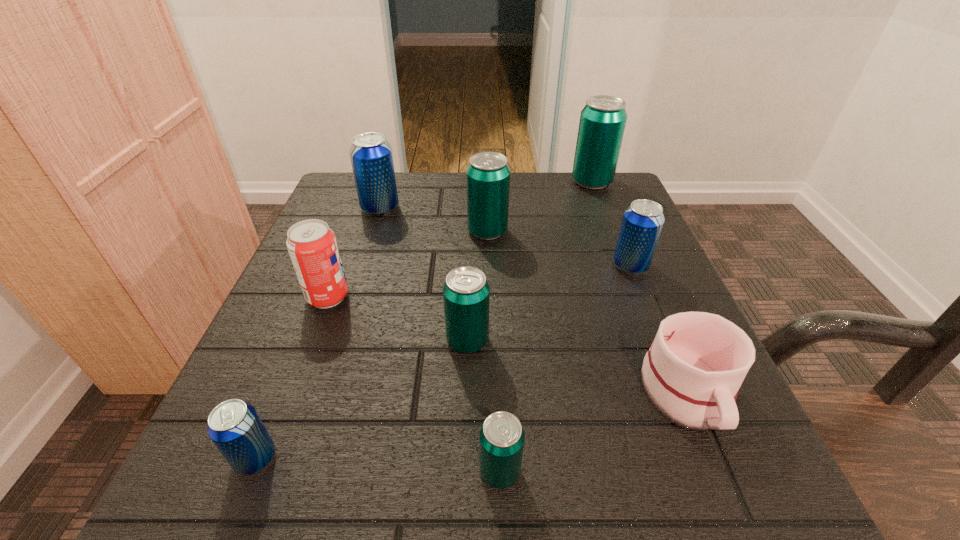
Find the location of a particular element. free space at the far edge of the desktop is located at coordinates (527, 219).

In the image, there is a desktop. Where is `vacant space at the near edge`? This screenshot has width=960, height=540. vacant space at the near edge is located at coordinates click(408, 496).

I want to click on free location at the left edge, so click(x=258, y=350).

The image size is (960, 540). Find the location of `vacant space at the right edge of the desktop`. vacant space at the right edge of the desktop is located at coordinates (645, 342).

This screenshot has width=960, height=540. In the image, there is a desktop. Identify the location of vacant space at the far left corner. (338, 213).

Find the location of a particular element. Image resolution: width=960 pixels, height=540 pixels. vacant region at the near left corner of the desktop is located at coordinates (255, 480).

Find the location of `blank space at the far right corner of the desktop`. blank space at the far right corner of the desktop is located at coordinates (590, 206).

Locate an element on the screen. vacant space at the near right corner of the desktop is located at coordinates (708, 495).

I want to click on free spot between the fourth farthest object and the third farthest object, so click(x=559, y=249).

The width and height of the screenshot is (960, 540). What are the coordinates of `empty space between the farthest teal beer can and the white mug` in the screenshot? It's located at (639, 288).